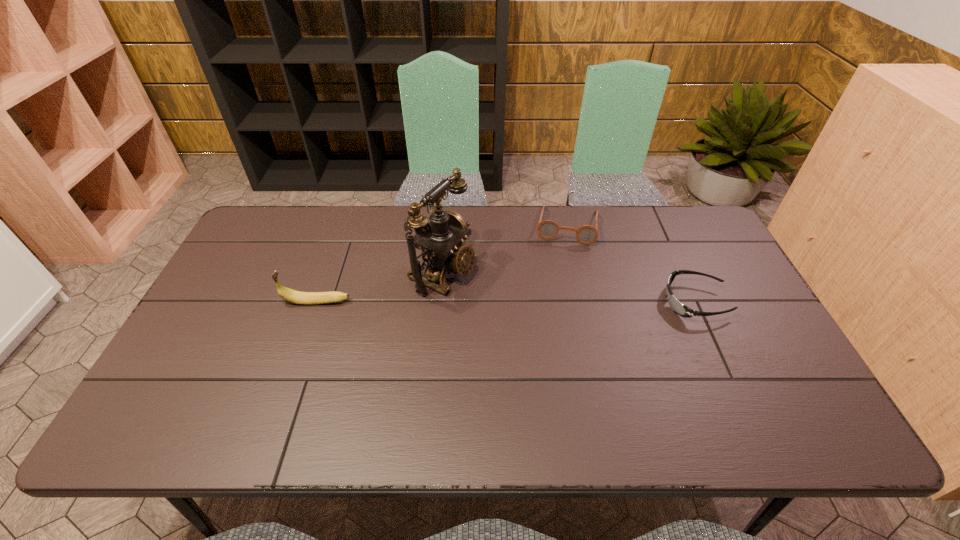
Image resolution: width=960 pixels, height=540 pixels. I want to click on vacant spot on the desktop that is between the second tallest object and the sunglasses and is positioned on the rotary dial of the third object from right to left, so click(511, 302).

The height and width of the screenshot is (540, 960). Identify the location of vacant space on the desktop that is between the leftmost object and the shortest object and is positioned on the front-facing side of the third object from left to right. (558, 302).